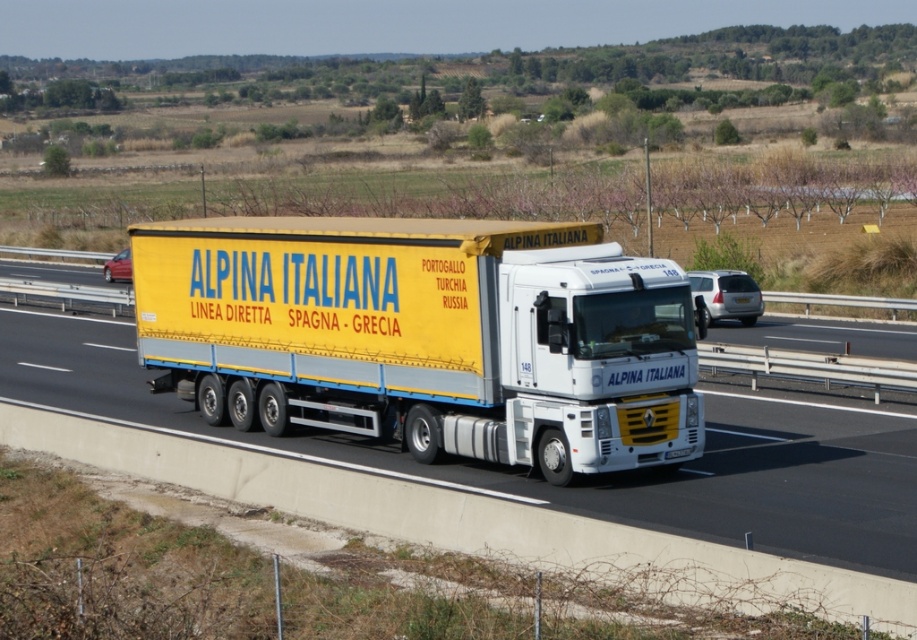
Is yellow matte trailer truck at center bigger than yellow matte truck at center?

Incorrect, yellow matte trailer truck at center is not larger than yellow matte truck at center.

Which of these two, yellow matte trailer truck at center or yellow matte truck at center, stands shorter?

yellow matte truck at center is shorter.

Identify the location of yellow matte trailer truck at center. This screenshot has width=917, height=640. (425, 336).